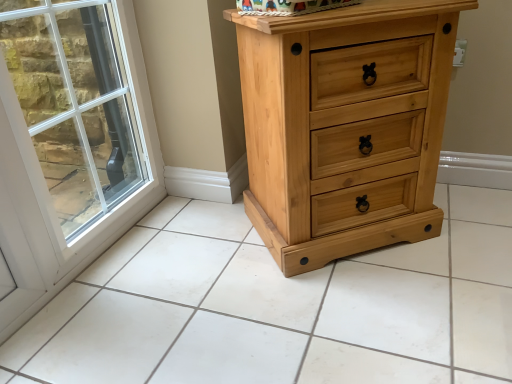
Question: Considering the relative sizes of white glass window at left and natural wood chest of drawers at right in the image provided, is white glass window at left smaller than natural wood chest of drawers at right?

Choices:
 (A) yes
 (B) no

Answer: (A)

Question: Is white glass window at left positioned before natural wood chest of drawers at right?

Choices:
 (A) yes
 (B) no

Answer: (A)

Question: From the image's perspective, is white glass window at left located beneath natural wood chest of drawers at right?

Choices:
 (A) no
 (B) yes

Answer: (B)

Question: Does white glass window at left have a lesser width compared to natural wood chest of drawers at right?

Choices:
 (A) yes
 (B) no

Answer: (A)

Question: Is white glass window at left wider than natural wood chest of drawers at right?

Choices:
 (A) yes
 (B) no

Answer: (B)

Question: Considering the positions of white glass window at left and natural wood tile at center in the image, is white glass window at left taller or shorter than natural wood tile at center?

Choices:
 (A) tall
 (B) short

Answer: (A)

Question: Is white glass window at left wider or thinner than natural wood tile at center?

Choices:
 (A) wide
 (B) thin

Answer: (B)

Question: From a real-world perspective, relative to natural wood tile at center, is white glass window at left vertically above or below?

Choices:
 (A) below
 (B) above

Answer: (B)

Question: Based on their sizes in the image, would you say white glass window at left is bigger or smaller than natural wood tile at center?

Choices:
 (A) small
 (B) big

Answer: (A)

Question: Considering their positions, is natural wood chest of drawers at right located in front of or behind white glass window at left?

Choices:
 (A) front
 (B) behind

Answer: (B)

Question: Does point (304, 162) appear closer or farther from the camera than point (74, 1)?

Choices:
 (A) closer
 (B) farther

Answer: (A)

Question: Is natural wood chest of drawers at right inside or outside of white glass window at left?

Choices:
 (A) inside
 (B) outside

Answer: (B)

Question: Considering the positions of natural wood chest of drawers at right and white glass window at left in the image, is natural wood chest of drawers at right wider or thinner than white glass window at left?

Choices:
 (A) thin
 (B) wide

Answer: (B)

Question: Does point (135, 142) appear closer or farther from the camera than point (263, 170)?

Choices:
 (A) farther
 (B) closer

Answer: (A)

Question: Considering the positions of white glass window at left and natural wood chest of drawers at right in the image, is white glass window at left taller or shorter than natural wood chest of drawers at right?

Choices:
 (A) short
 (B) tall

Answer: (B)